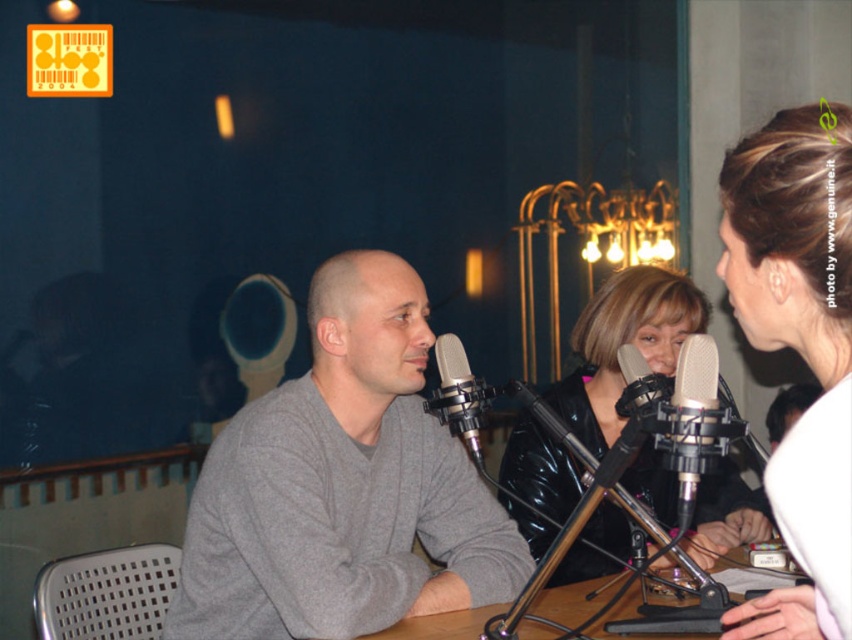
You are a sound engineer adjusting the studio setup. You need to place a new equipment rack between the gray matte sweater at center and the silver metallic microphone at center. Based on their widths, will the rack fit if it requires 1.2 meters of space?

The gray matte sweater at center might be wider than the silver metallic microphone at center, but without exact measurements, it is uncertain if the 1.2 meters of space will be sufficient. Check the actual dimensions before placing the rack.